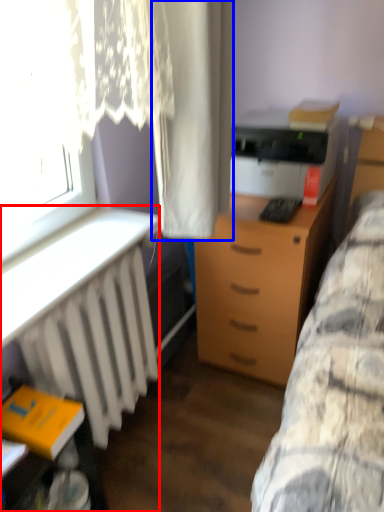
Question: Which point is further to the camera, desk (highlighted by a red box) or curtain (highlighted by a blue box)?

Choices:
 (A) desk
 (B) curtain

Answer: (A)